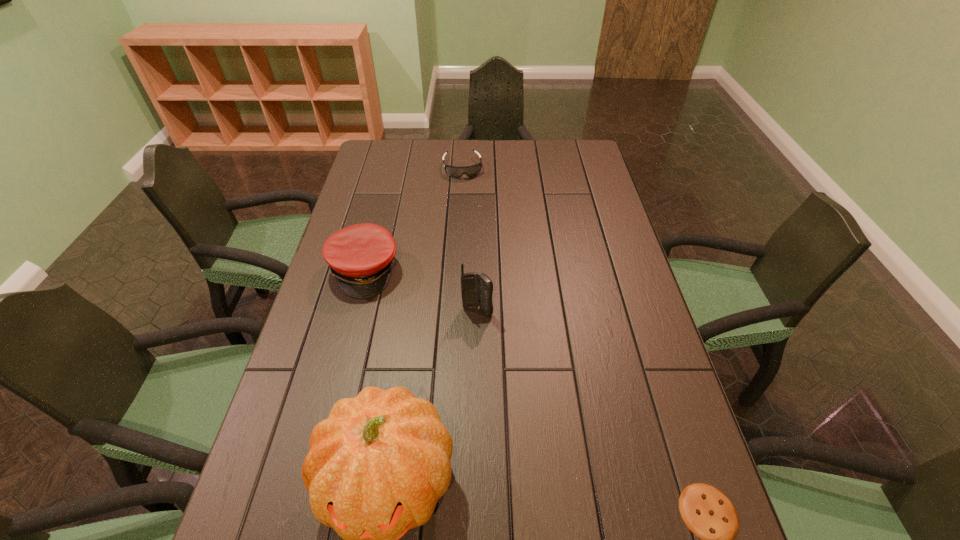
This screenshot has width=960, height=540. I want to click on vacant space located 0.090m on the front of the third tallest object with an emblem, so click(391, 315).

Image resolution: width=960 pixels, height=540 pixels. What are the coordinates of `vacant space located 0.360m on the front of the third tallest object with an emblem` in the screenshot? It's located at (437, 391).

Find the location of a particular element. The width and height of the screenshot is (960, 540). vacant position located 0.270m on the keyboard of the third farthest object is located at coordinates (493, 410).

Identify the location of free region located on the keyboard of the third farthest object. (495, 422).

Locate an element on the screen. The width and height of the screenshot is (960, 540). free region located on the keyboard of the third farthest object is located at coordinates (498, 440).

Where is `object present at the far edge`? object present at the far edge is located at coordinates pos(470,171).

Where is `object that is at the left edge`? object that is at the left edge is located at coordinates (360, 257).

What are the coordinates of `vacant space at the far edge of the desktop` in the screenshot? It's located at (406, 162).

Locate an element on the screen. This screenshot has width=960, height=540. vacant space at the near edge of the desktop is located at coordinates (479, 501).

Locate an element on the screen. vacant region at the left edge of the desktop is located at coordinates (380, 220).